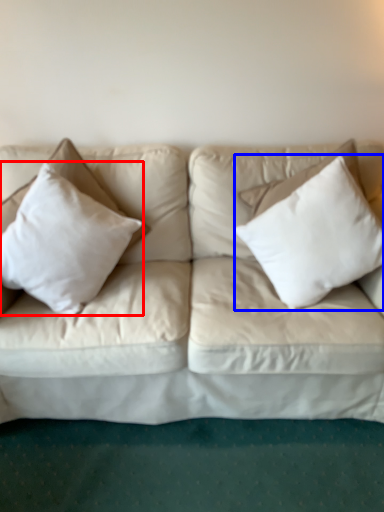
Question: Which point is further to the camera, pillow (highlighted by a red box) or pillow (highlighted by a blue box)?

Choices:
 (A) pillow
 (B) pillow

Answer: (B)